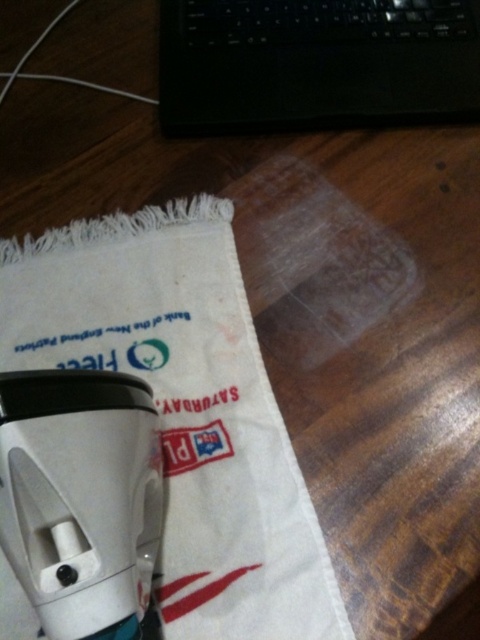
Which is more to the right, white cotton bag at center or black plastic laptop at upper center?

From the viewer's perspective, black plastic laptop at upper center appears more on the right side.

Describe the element at coordinates (184, 410) in the screenshot. I see `white cotton bag at center` at that location.

Between point (187, 433) and point (348, 3), which one is positioned in front?

Point (187, 433) is in front.

I want to click on white cotton bag at center, so click(184, 410).